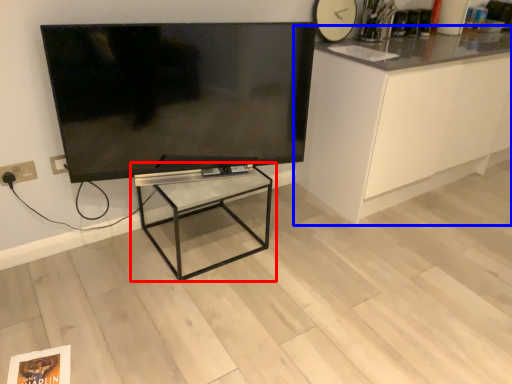
Question: Which object appears farthest to the camera in this image, table (highlighted by a red box) or cabinetry (highlighted by a blue box)?

Choices:
 (A) table
 (B) cabinetry

Answer: (B)